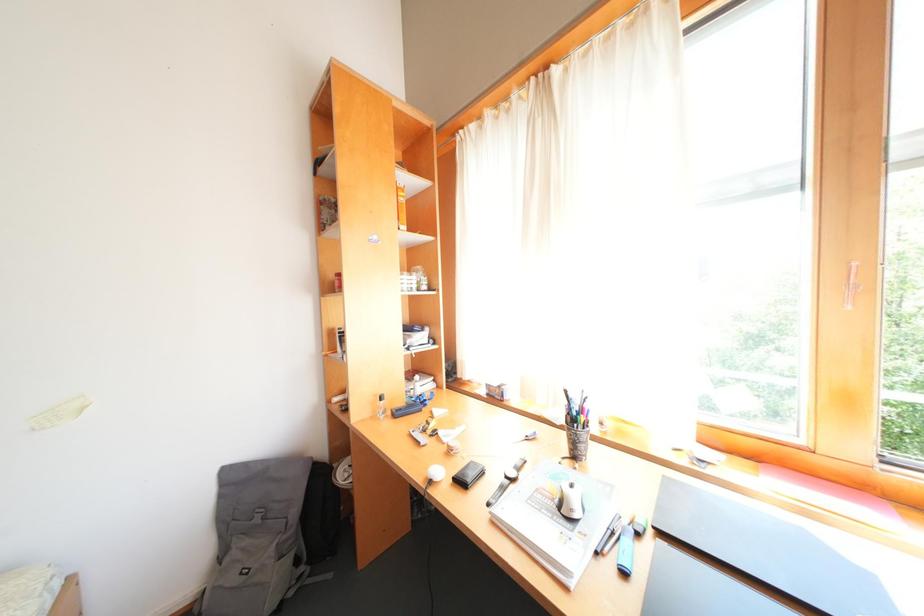
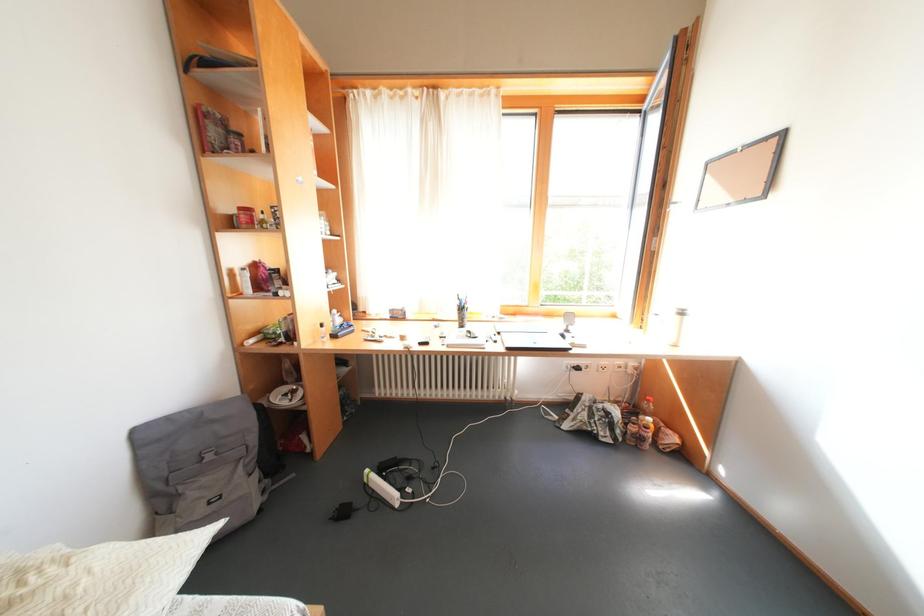
Question: How did the camera likely rotate?

Choices:
 (A) Left
 (B) Right
 (C) Up
 (D) Down

Answer: (B)